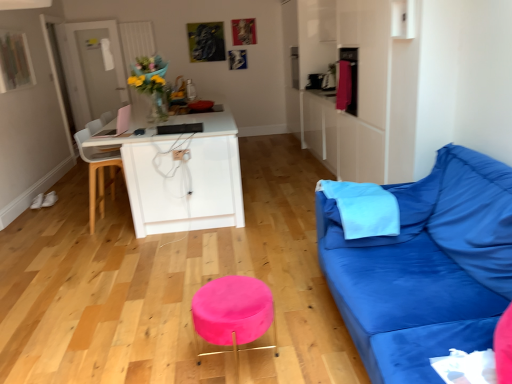
What is the approximate height of white plastic chair at left?

It is 35.71 inches.

Based on the photo, measure the distance between white plastic chair at left and camera.

The distance of white plastic chair at left from camera is 12.97 feet.

Measure the distance between pink velvet stool at center and camera.

A distance of 1.91 meters exists between pink velvet stool at center and camera.

You are a GUI agent. You are given a task and a screenshot of the screen. Output one action in this format:
    pyautogui.click(x=<x>, y=<y>)
    Task: Click on the pink velvet stool at center
    This screenshot has width=512, height=384.
    Given the screenshot: What is the action you would take?
    pyautogui.click(x=233, y=313)

Locate an element on the screen. The image size is (512, 384). blue fabric couch at right is located at coordinates pyautogui.click(x=426, y=268).

The width and height of the screenshot is (512, 384). I want to click on light blue fabric pillow at right, arranged as the 1th pillow when viewed from the left, so click(x=362, y=208).

Is white plastic chair at left taller than blue fabric pillow at right, which ranks as the 1th pillow in right-to-left order?

Yes, white plastic chair at left is taller than blue fabric pillow at right, which ranks as the 1th pillow in right-to-left order.

Are white plastic chair at left and blue fabric pillow at right, the 2th pillow positioned from the left, far apart?

white plastic chair at left is positioned a significant distance from blue fabric pillow at right, the 2th pillow positioned from the left.

Is white plastic chair at left at the right side of blue fabric pillow at right, which ranks as the 1th pillow in right-to-left order?

Incorrect, white plastic chair at left is not on the right side of blue fabric pillow at right, which ranks as the 1th pillow in right-to-left order.

How many degrees apart are the facing directions of white plastic chair at left and blue fabric pillow at right, which ranks as the 1th pillow in right-to-left order?

81.5 degrees separate the facing orientations of white plastic chair at left and blue fabric pillow at right, which ranks as the 1th pillow in right-to-left order.

Looking at their sizes, would you say blue fabric couch at right is wider or thinner than blue fabric pillow at right, the 2th pillow positioned from the left?

In the image, blue fabric couch at right appears to be wider than blue fabric pillow at right, the 2th pillow positioned from the left.

In terms of size, does blue fabric couch at right appear bigger or smaller than blue fabric pillow at right, which ranks as the 1th pillow in right-to-left order?

Considering their sizes, blue fabric couch at right takes up more space than blue fabric pillow at right, which ranks as the 1th pillow in right-to-left order.

Considering the positions of objects blue fabric couch at right and blue fabric pillow at right, the 2th pillow positioned from the left, in the image provided, who is more to the right, blue fabric couch at right or blue fabric pillow at right, the 2th pillow positioned from the left,?

Positioned to the right is blue fabric couch at right.

Is blue fabric couch at right next to blue fabric pillow at right, which ranks as the 1th pillow in right-to-left order?

There is a gap between blue fabric couch at right and blue fabric pillow at right, which ranks as the 1th pillow in right-to-left order.

Is light blue fabric pillow at right, arranged as the 1th pillow when viewed from the left, aimed at pink velvet stool at center?

No, light blue fabric pillow at right, arranged as the 1th pillow when viewed from the left, is not turned towards pink velvet stool at center.

Is point (392, 222) positioned behind point (219, 328)?

Yes, point (392, 222) is behind point (219, 328).

Between light blue fabric pillow at right, arranged as the 1th pillow when viewed from the left, and pink velvet stool at center, which one appears on the right side from the viewer's perspective?

From the viewer's perspective, light blue fabric pillow at right, arranged as the 1th pillow when viewed from the left, appears more on the right side.

Is light blue fabric pillow at right, arranged as the 1th pillow when viewed from the left, shorter than pink velvet stool at center?

Yes, light blue fabric pillow at right, arranged as the 1th pillow when viewed from the left, is shorter than pink velvet stool at center.

Is blue fabric couch at right far away from white plastic chair at left?

Yes.

Is point (433, 278) closer or farther from the camera than point (94, 214)?

Point (433, 278) is positioned closer to the camera compared to point (94, 214).

Considering the positions of objects blue fabric couch at right and white plastic chair at left in the image provided, who is in front, blue fabric couch at right or white plastic chair at left?

blue fabric couch at right is closer to the camera.

From a real-world perspective, between white plastic chair at left and pink velvet stool at center, who is vertically lower?

From a 3D spatial view, pink velvet stool at center is below.

Would you say pink velvet stool at center is part of white plastic chair at left's contents?

That's incorrect, pink velvet stool at center is not inside white plastic chair at left.

Can you tell me how much white plastic chair at left and pink velvet stool at center differ in facing direction?

The angular difference between white plastic chair at left and pink velvet stool at center is 174 degrees.

Would you say light blue fabric pillow at right, the 2th pillow positioned from the right, is part of blue fabric couch at right's contents?

Absolutely, light blue fabric pillow at right, the 2th pillow positioned from the right, is inside blue fabric couch at right.

From the image's perspective, is blue fabric couch at right under light blue fabric pillow at right, arranged as the 1th pillow when viewed from the left?

Indeed, from the image's perspective, blue fabric couch at right is shown beneath light blue fabric pillow at right, arranged as the 1th pillow when viewed from the left.

Is blue fabric couch at right aimed at light blue fabric pillow at right, arranged as the 1th pillow when viewed from the left?

Yes, blue fabric couch at right is aimed at light blue fabric pillow at right, arranged as the 1th pillow when viewed from the left.

What's the angular difference between blue fabric couch at right and light blue fabric pillow at right, the 2th pillow positioned from the right,'s facing directions?

The angle between the facing direction of blue fabric couch at right and the facing direction of light blue fabric pillow at right, the 2th pillow positioned from the right, is 92.2 degrees.

Can you confirm if pink velvet stool at center is thinner than white plastic chair at left?

Correct, the width of pink velvet stool at center is less than that of white plastic chair at left.

In terms of size, does pink velvet stool at center appear bigger or smaller than white plastic chair at left?

Clearly, pink velvet stool at center is smaller in size than white plastic chair at left.

Is point (216, 292) less distant than point (90, 233)?

Yes.

Is pink velvet stool at center shorter than white plastic chair at left?

Yes, pink velvet stool at center is shorter than white plastic chair at left.

Locate an element on the screen. chair that appears below the blue fabric pillow at right, which ranks as the 1th pillow in right-to-left order (from a real-world perspective) is located at coordinates [97, 174].

This screenshot has width=512, height=384. Identify the location of studio couch on the right of blue fabric pillow at right, the 2th pillow positioned from the left. (426, 268).

Considering their positions, is blue fabric pillow at right, the 2th pillow positioned from the left, positioned closer to pink velvet stool at center than white plastic chair at left?

blue fabric pillow at right, the 2th pillow positioned from the left.

When comparing their distances from blue fabric pillow at right, which ranks as the 1th pillow in right-to-left order, does light blue fabric pillow at right, the 2th pillow positioned from the right, or pink velvet stool at center seem further?

Based on the image, pink velvet stool at center appears to be further to blue fabric pillow at right, which ranks as the 1th pillow in right-to-left order.

Looking at the image, which one is located closer to light blue fabric pillow at right, arranged as the 1th pillow when viewed from the left, white plastic chair at left or pink velvet stool at center?

Based on the image, pink velvet stool at center appears to be nearer to light blue fabric pillow at right, arranged as the 1th pillow when viewed from the left.

Estimate the real-world distances between objects in this image. Which object is closer to white plastic chair at left, blue fabric couch at right or blue fabric pillow at right, the 2th pillow positioned from the left?

The object closer to white plastic chair at left is blue fabric pillow at right, the 2th pillow positioned from the left.

Which object lies nearer to the anchor point pink velvet stool at center, blue fabric couch at right or white plastic chair at left?

blue fabric couch at right is closer to pink velvet stool at center.

From the image, which object appears to be farther from light blue fabric pillow at right, the 2th pillow positioned from the right, pink velvet stool at center or blue fabric pillow at right, the 2th pillow positioned from the left?

pink velvet stool at center is positioned further to the anchor light blue fabric pillow at right, the 2th pillow positioned from the right.

Based on the photo, estimate the real-world distances between objects in this image. Which object is further from blue fabric pillow at right, which ranks as the 1th pillow in right-to-left order, white plastic chair at left or pink velvet stool at center?

white plastic chair at left is positioned further to the anchor blue fabric pillow at right, which ranks as the 1th pillow in right-to-left order.

When comparing their distances from white plastic chair at left, does blue fabric pillow at right, which ranks as the 1th pillow in right-to-left order, or blue fabric couch at right seem further?

The object further to white plastic chair at left is blue fabric couch at right.

Identify the location of bar stool positioned between blue fabric couch at right and white plastic chair at left from near to far. (233, 313).

Identify the location of bar stool located between blue fabric couch at right and light blue fabric pillow at right, the 2th pillow positioned from the right, in the depth direction. (233, 313).

Locate an element on the screen. bar stool situated between white plastic chair at left and light blue fabric pillow at right, the 2th pillow positioned from the right, from left to right is located at coordinates (233, 313).

Find the location of `pillow between blue fabric couch at right and light blue fabric pillow at right, arranged as the 1th pillow when viewed from the left, from front to back`. pillow between blue fabric couch at right and light blue fabric pillow at right, arranged as the 1th pillow when viewed from the left, from front to back is located at coordinates (399, 210).